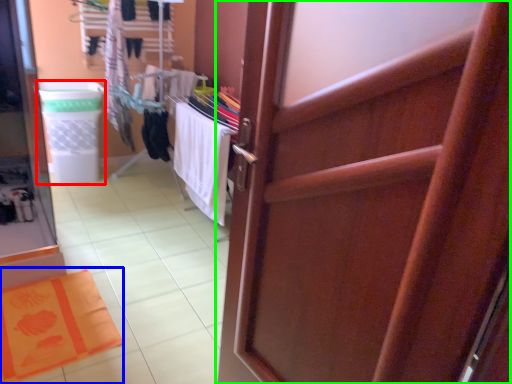
Question: Based on their relative distances, which object is farther from laundry basket (highlighted by a red box)? Choose from bath mat (highlighted by a blue box) and door (highlighted by a green box).

Choices:
 (A) bath mat
 (B) door

Answer: (B)